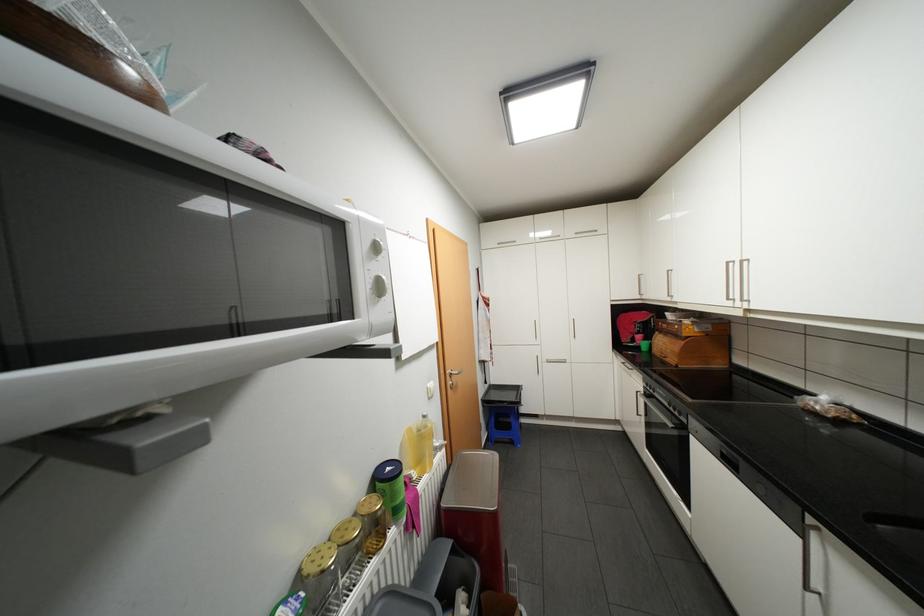
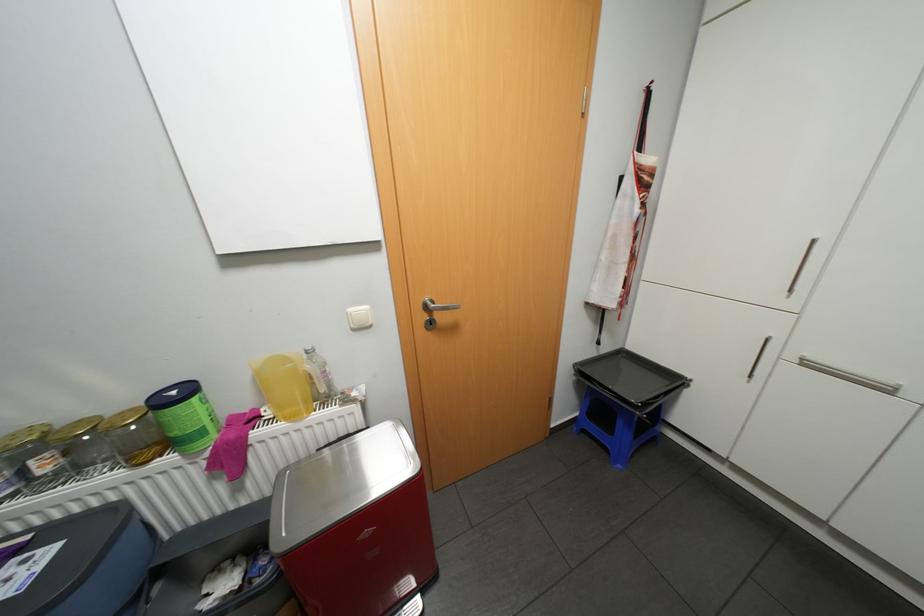
Where in the second image is the point corresponding to the point at 422,474 from the first image?

(275, 413)